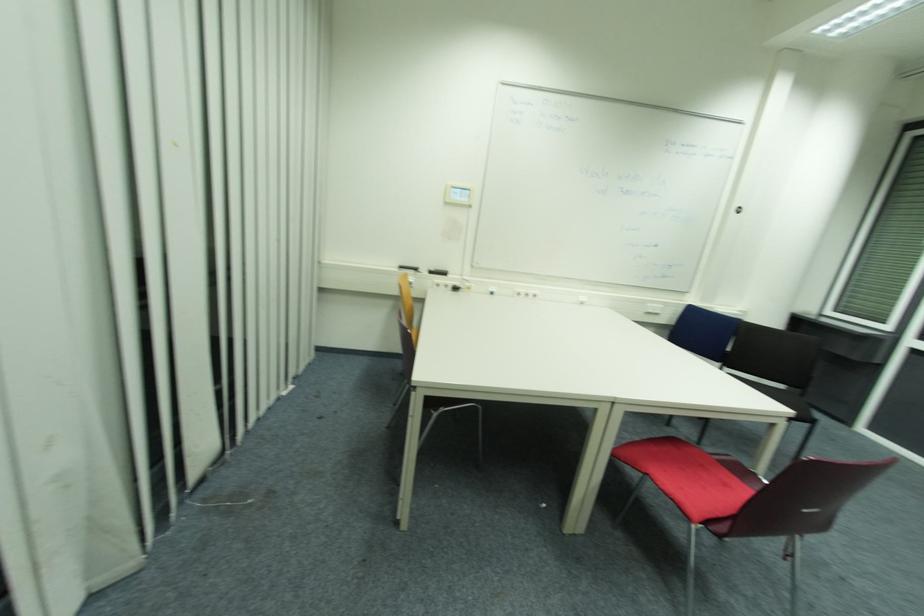
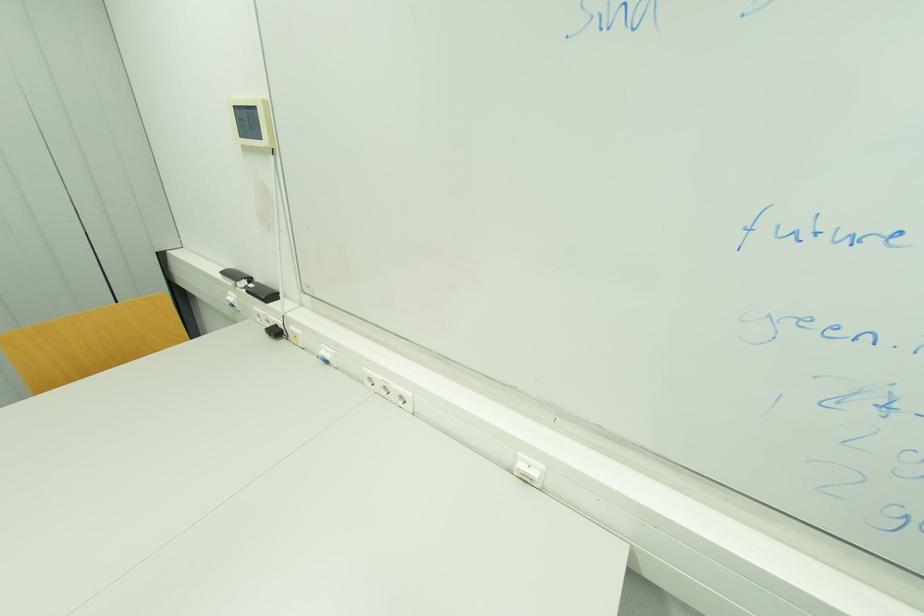
Where in the second image is the point corresponding to [494,294] from the first image?

(330, 362)